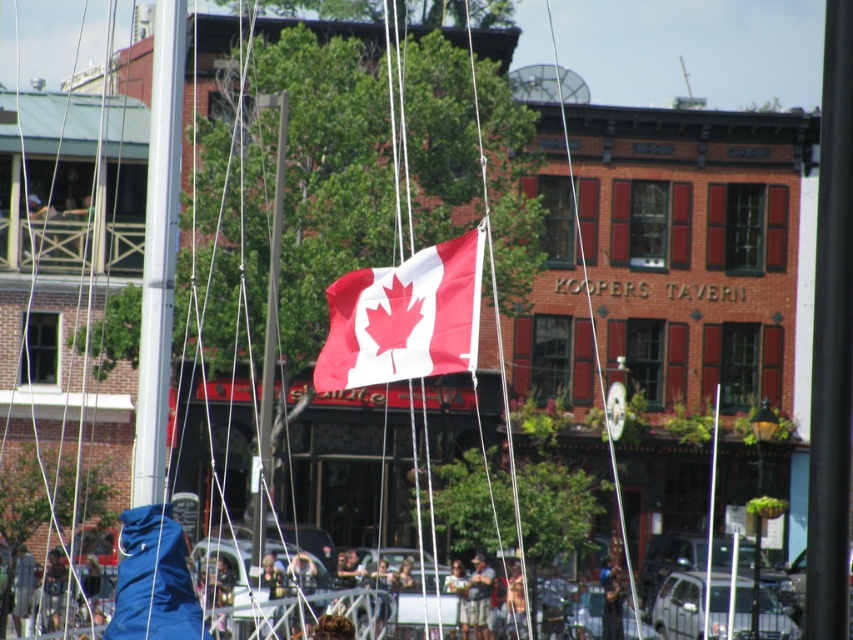
You are a photographer trying to capture the polyester canadian flag at center in your shot. Based on its position, can you confirm if it is centrally aligned within the frame?

The polyester canadian flag at center is located at point (404, 317), which is very close to the center coordinates of the frame. Therefore, it is centrally aligned within the frame.

You are a photographer setting up a shot of the polyester canadian flag at center and the metallic silver pole at center. Which object should you focus on first if you want to capture both in the same frame without moving the camera?

The polyester canadian flag at center is shorter than the metallic silver pole at center, so you should focus on the metallic silver pole at center first as it is taller and may require more adjustment to fit within the frame.

You are a photographer standing at the edge of the marina. You want to take a photo that includes both the polyester canadian flag at center and the metallic silver pole at center. The camera you are using has a maximum focus range of 35 meters. Will both objects be in focus if you focus on the flag?

The polyester canadian flag at center is 37.51 meters away from the metallic silver pole at center. Since the camera can only focus up to 35 meters, the distance between them exceeds the focus range. Therefore, both objects cannot be in focus simultaneously.